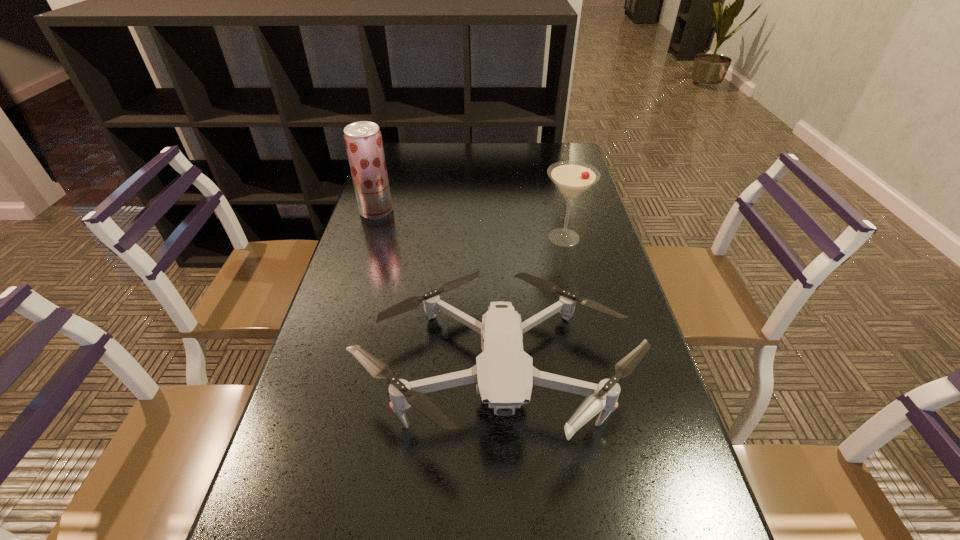
Identify the location of the closest object to the second shortest object. (504, 373).

Select which object is the closest to the second tallest object. Please provide its 2D coordinates. Your answer should be formatted as a tuple, i.e. [(x, y)], where the tuple contains the x and y coordinates of a point satisfying the conditions above.

[(504, 373)]

Identify the location of free space that satisfies the following two spatial constraints: 1. on the front side of the tallest object; 2. on the left side of the second nearest object. This screenshot has height=540, width=960. (368, 238).

Find the location of a particular element. vacant region that satisfies the following two spatial constraints: 1. on the front side of the farthest object; 2. on the right side of the second tallest object is located at coordinates (368, 238).